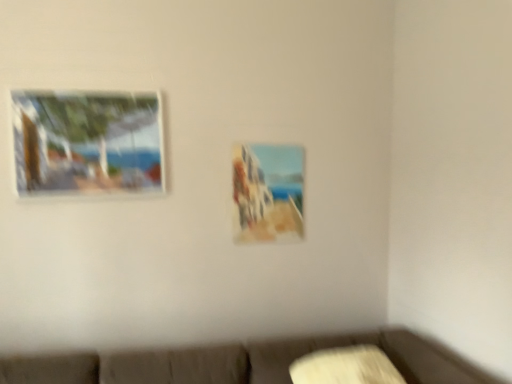
You are a GUI agent. You are given a task and a screenshot of the screen. Output one action in this format:
    pyautogui.click(x=<x>, y=<y>)
    Task: Click on the matte wooden picture frame at upper left, the 1th picture frame when ordered from front to back
    The image size is (512, 384).
    Given the screenshot: What is the action you would take?
    pyautogui.click(x=87, y=142)

The height and width of the screenshot is (384, 512). Describe the element at coordinates (87, 142) in the screenshot. I see `matte wooden picture frame at upper left, the 1th picture frame when ordered from front to back` at that location.

What do you see at coordinates (268, 193) in the screenshot?
I see `matte glass painting at center, marked as the 1th picture frame in a back-to-front arrangement` at bounding box center [268, 193].

What is the approximate height of matte glass painting at center, marked as the 1th picture frame in a back-to-front arrangement?

matte glass painting at center, marked as the 1th picture frame in a back-to-front arrangement, is 22.31 inches in height.

Identify the location of matte glass painting at center, which is counted as the 2th picture frame, starting from the front. (268, 193).

How much space does matte glass painting at center, which is counted as the 2th picture frame, starting from the front, occupy horizontally?

3.49 centimeters.

Where is `matte wooden picture frame at upper left, the 1th picture frame when ordered from front to back`? matte wooden picture frame at upper left, the 1th picture frame when ordered from front to back is located at coordinates (87, 142).

Which object is positioned more to the left, matte wooden picture frame at upper left, marked as the 1th picture frame in a left-to-right arrangement, or matte glass painting at center, which is counted as the 2th picture frame, starting from the front?

matte wooden picture frame at upper left, marked as the 1th picture frame in a left-to-right arrangement, is more to the left.

Which object is further away from the camera, matte wooden picture frame at upper left, marked as the 1th picture frame in a left-to-right arrangement, or matte glass painting at center, marked as the 1th picture frame in a back-to-front arrangement?

matte glass painting at center, marked as the 1th picture frame in a back-to-front arrangement, is further from the camera.

Between point (80, 148) and point (262, 194), which one is positioned behind?

The point (262, 194) is behind.

From the image's perspective, is matte wooden picture frame at upper left, the 1th picture frame when ordered from front to back, positioned above or below matte glass painting at center, which is counted as the 2th picture frame, starting from the left?

matte wooden picture frame at upper left, the 1th picture frame when ordered from front to back, is above matte glass painting at center, which is counted as the 2th picture frame, starting from the left.

From a real-world perspective, does matte wooden picture frame at upper left, marked as the 1th picture frame in a left-to-right arrangement, stand above matte glass painting at center, the first picture frame when ordered from right to left?

Yes, from a real-world perspective, matte wooden picture frame at upper left, marked as the 1th picture frame in a left-to-right arrangement, is on top of matte glass painting at center, the first picture frame when ordered from right to left.

Considering the relative sizes of matte wooden picture frame at upper left, arranged as the second picture frame when viewed from the back, and matte glass painting at center, marked as the 1th picture frame in a back-to-front arrangement, in the image provided, is matte wooden picture frame at upper left, arranged as the second picture frame when viewed from the back, wider than matte glass painting at center, marked as the 1th picture frame in a back-to-front arrangement,?

Indeed, matte wooden picture frame at upper left, arranged as the second picture frame when viewed from the back, has a greater width compared to matte glass painting at center, marked as the 1th picture frame in a back-to-front arrangement.

Is matte wooden picture frame at upper left, the 1th picture frame when ordered from front to back, shorter than matte glass painting at center, marked as the 1th picture frame in a back-to-front arrangement?

Correct, matte wooden picture frame at upper left, the 1th picture frame when ordered from front to back, is not as tall as matte glass painting at center, marked as the 1th picture frame in a back-to-front arrangement.

Can you confirm if matte wooden picture frame at upper left, which is the second picture frame in right-to-left order, is bigger than matte glass painting at center, the first picture frame when ordered from right to left?

Indeed, matte wooden picture frame at upper left, which is the second picture frame in right-to-left order, has a larger size compared to matte glass painting at center, the first picture frame when ordered from right to left.

Could matte glass painting at center, which is counted as the 2th picture frame, starting from the front, be considered to be inside matte wooden picture frame at upper left, the 1th picture frame when ordered from front to back?

No, matte glass painting at center, which is counted as the 2th picture frame, starting from the front, is not a part of matte wooden picture frame at upper left, the 1th picture frame when ordered from front to back.

Is matte wooden picture frame at upper left, the 1th picture frame when ordered from front to back, directly adjacent to matte glass painting at center, which is counted as the 2th picture frame, starting from the left?

matte wooden picture frame at upper left, the 1th picture frame when ordered from front to back, is not next to matte glass painting at center, which is counted as the 2th picture frame, starting from the left, and they're not touching.

Is matte wooden picture frame at upper left, marked as the 1th picture frame in a left-to-right arrangement, looking in the opposite direction of matte glass painting at center, which is counted as the 2th picture frame, starting from the left?

No, matte glass painting at center, which is counted as the 2th picture frame, starting from the left, is not at the back of matte wooden picture frame at upper left, marked as the 1th picture frame in a left-to-right arrangement.

In the image, there is a matte wooden picture frame at upper left, marked as the 1th picture frame in a left-to-right arrangement. In order to click on picture frame below it (from a real-world perspective) in this screenshot , I will do `click(268, 193)`.

Is matte glass painting at center, which is counted as the 2th picture frame, starting from the left, at the right side of matte wooden picture frame at upper left, the 1th picture frame when ordered from front to back?

Correct, you'll find matte glass painting at center, which is counted as the 2th picture frame, starting from the left, to the right of matte wooden picture frame at upper left, the 1th picture frame when ordered from front to back.

Considering their positions, is matte glass painting at center, the first picture frame when ordered from right to left, located in front of or behind matte wooden picture frame at upper left, marked as the 1th picture frame in a left-to-right arrangement?

matte glass painting at center, the first picture frame when ordered from right to left, is positioned farther from the viewer than matte wooden picture frame at upper left, marked as the 1th picture frame in a left-to-right arrangement.

Is point (296, 164) positioned after point (40, 104)?

Yes.

From the image's perspective, which is above, matte glass painting at center, which is counted as the 2th picture frame, starting from the front, or matte wooden picture frame at upper left, arranged as the second picture frame when viewed from the back?

matte wooden picture frame at upper left, arranged as the second picture frame when viewed from the back, from the image's perspective.

From a real-world perspective, does matte glass painting at center, which is counted as the 2th picture frame, starting from the front, stand above matte wooden picture frame at upper left, marked as the 1th picture frame in a left-to-right arrangement?

No, from a real-world perspective, matte glass painting at center, which is counted as the 2th picture frame, starting from the front, is not on top of matte wooden picture frame at upper left, marked as the 1th picture frame in a left-to-right arrangement.

In terms of width, does matte glass painting at center, which is counted as the 2th picture frame, starting from the left, look wider or thinner when compared to matte wooden picture frame at upper left, the 1th picture frame when ordered from front to back?

In the image, matte glass painting at center, which is counted as the 2th picture frame, starting from the left, appears to be more narrow than matte wooden picture frame at upper left, the 1th picture frame when ordered from front to back.

Can you confirm if matte glass painting at center, the first picture frame when ordered from right to left, is taller than matte wooden picture frame at upper left, arranged as the second picture frame when viewed from the back?

Correct, matte glass painting at center, the first picture frame when ordered from right to left, is much taller as matte wooden picture frame at upper left, arranged as the second picture frame when viewed from the back.

Based on their sizes in the image, would you say matte glass painting at center, which is counted as the 2th picture frame, starting from the left, is bigger or smaller than matte wooden picture frame at upper left, arranged as the second picture frame when viewed from the back?

In the image, matte glass painting at center, which is counted as the 2th picture frame, starting from the left, appears to be smaller than matte wooden picture frame at upper left, arranged as the second picture frame when viewed from the back.

Can matte wooden picture frame at upper left, which is the second picture frame in right-to-left order, be found inside matte glass painting at center, which is counted as the 2th picture frame, starting from the front?

Definitely not — matte wooden picture frame at upper left, which is the second picture frame in right-to-left order, is not inside matte glass painting at center, which is counted as the 2th picture frame, starting from the front.

Is matte glass painting at center, the first picture frame when ordered from right to left, with matte wooden picture frame at upper left, which is the second picture frame in right-to-left order?

There is a gap between matte glass painting at center, the first picture frame when ordered from right to left, and matte wooden picture frame at upper left, which is the second picture frame in right-to-left order.

Is matte glass painting at center, marked as the 1th picture frame in a back-to-front arrangement, looking in the opposite direction of matte wooden picture frame at upper left, the 1th picture frame when ordered from front to back?

No, matte wooden picture frame at upper left, the 1th picture frame when ordered from front to back, is not at the back of matte glass painting at center, marked as the 1th picture frame in a back-to-front arrangement.

Measure the distance between matte glass painting at center, the first picture frame when ordered from right to left, and matte wooden picture frame at upper left, marked as the 1th picture frame in a left-to-right arrangement.

matte glass painting at center, the first picture frame when ordered from right to left, and matte wooden picture frame at upper left, marked as the 1th picture frame in a left-to-right arrangement, are 27.05 inches apart.

The height and width of the screenshot is (384, 512). Find the location of `picture frame on the right of the matte wooden picture frame at upper left, arranged as the second picture frame when viewed from the back`. picture frame on the right of the matte wooden picture frame at upper left, arranged as the second picture frame when viewed from the back is located at coordinates (268, 193).

Where is `picture frame on the right of matte wooden picture frame at upper left, which is the second picture frame in right-to-left order`? This screenshot has height=384, width=512. picture frame on the right of matte wooden picture frame at upper left, which is the second picture frame in right-to-left order is located at coordinates (268, 193).

Where is `picture frame behind the matte wooden picture frame at upper left, marked as the 1th picture frame in a left-to-right arrangement`? Image resolution: width=512 pixels, height=384 pixels. picture frame behind the matte wooden picture frame at upper left, marked as the 1th picture frame in a left-to-right arrangement is located at coordinates (268, 193).